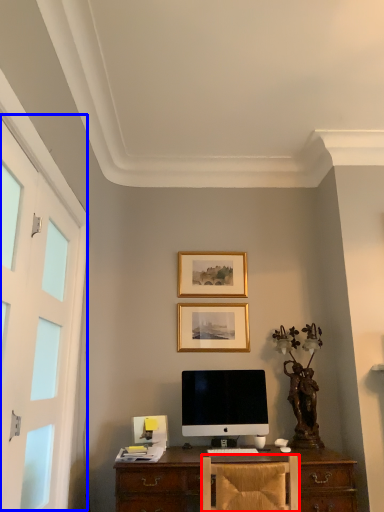
Question: Among these objects, which one is nearest to the camera, chair (highlighted by a red box) or screen door (highlighted by a blue box)?

Choices:
 (A) chair
 (B) screen door

Answer: (B)